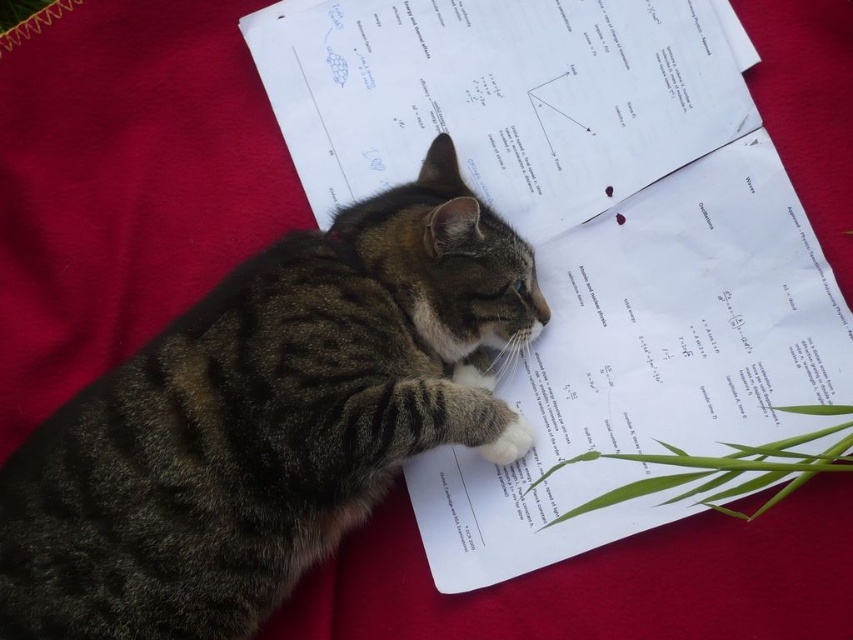
From the picture: You are a student who needs to access the white paper at center. The tabby fur cat at center is blocking your path. Can you move around the cat to reach the paper without disturbing it?

The tabby fur cat at center is positioned on the left side of white paper at center, so you can move around the cat to the right side to reach the white paper at center without disturbing it.

You are a photographer standing at the camera position. You want to take a closeup photo of the tabby fur cat at center. The camera can focus on objects within 3 feet. Will the cat be in focus?

The tabby fur cat at center is 3.59 feet away from camera. Since the camera can focus within 3 feet, the cat is slightly out of focus range. Therefore, the cat will not be in focus.